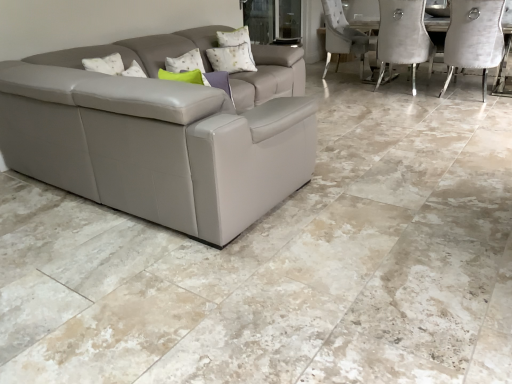
Question: Is point (252, 59) closer or farther from the camera than point (276, 1)?

Choices:
 (A) farther
 (B) closer

Answer: (B)

Question: Is white textured pillow at upper center taller or shorter than transparent glass door at upper center?

Choices:
 (A) short
 (B) tall

Answer: (A)

Question: Which object is positioned closest to the velvet grey chair at upper right?

Choices:
 (A) white textured pillow at upper center
 (B) transparent glass door at upper center

Answer: (B)

Question: Which is farther from the transparent glass door at upper center?

Choices:
 (A) white textured pillow at upper center
 (B) velvet grey chair at upper right

Answer: (B)